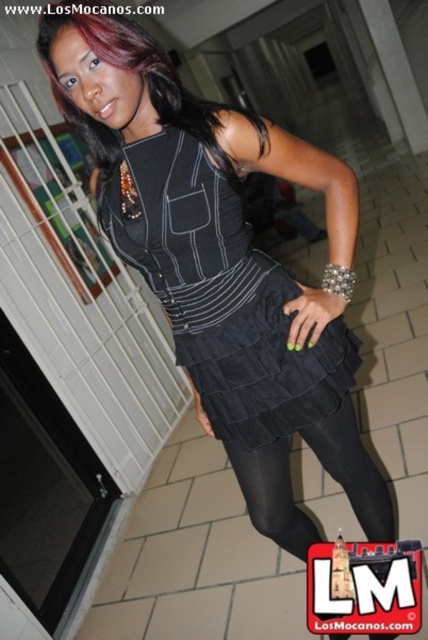
Question: Is black suede dress at center to the right of black shiny hair at center from the viewer's perspective?

Choices:
 (A) no
 (B) yes

Answer: (B)

Question: From the image, what is the correct spatial relationship of black shiny hair at center in relation to black satin skirt at lower center?

Choices:
 (A) right
 (B) left

Answer: (B)

Question: Which object is positioned closest to the black shiny hair at center?

Choices:
 (A) black satin skirt at lower center
 (B) black suede dress at center

Answer: (B)

Question: Considering the relative positions of black shiny hair at center and black satin skirt at lower center in the image provided, where is black shiny hair at center located with respect to black satin skirt at lower center?

Choices:
 (A) below
 (B) above

Answer: (B)

Question: Which of the following is the closest to the observer?

Choices:
 (A) (281, 461)
 (B) (124, 45)

Answer: (B)

Question: Which of these objects is positioned farthest from the black shiny hair at center?

Choices:
 (A) black suede dress at center
 (B) black satin skirt at lower center

Answer: (B)